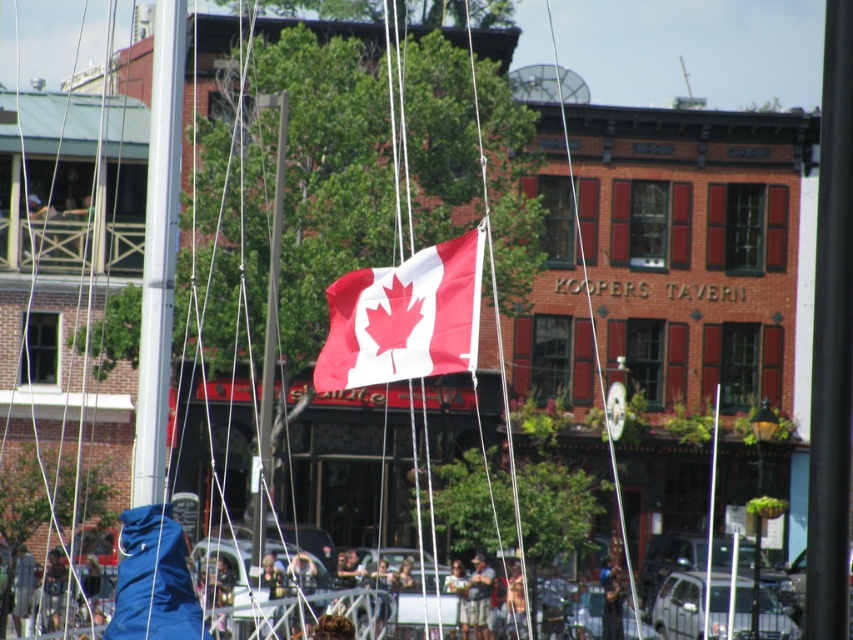
In the scene shown: Who is higher up, polyester canadian flag at center or metallic silver pole at center?

polyester canadian flag at center

Who is more distant from viewer, (473, 365) or (718, 397)?

The point (718, 397) is more distant.

Image resolution: width=853 pixels, height=640 pixels. What do you see at coordinates (404, 317) in the screenshot? I see `polyester canadian flag at center` at bounding box center [404, 317].

What are the coordinates of `polyester canadian flag at center` in the screenshot? It's located at (404, 317).